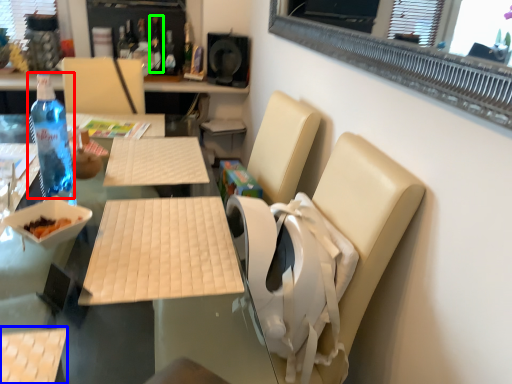
Question: Which object is positioned closest to bottle (highlighted by a red box)? Select from armchair (highlighted by a blue box) and bottle (highlighted by a green box).

Choices:
 (A) armchair
 (B) bottle

Answer: (A)